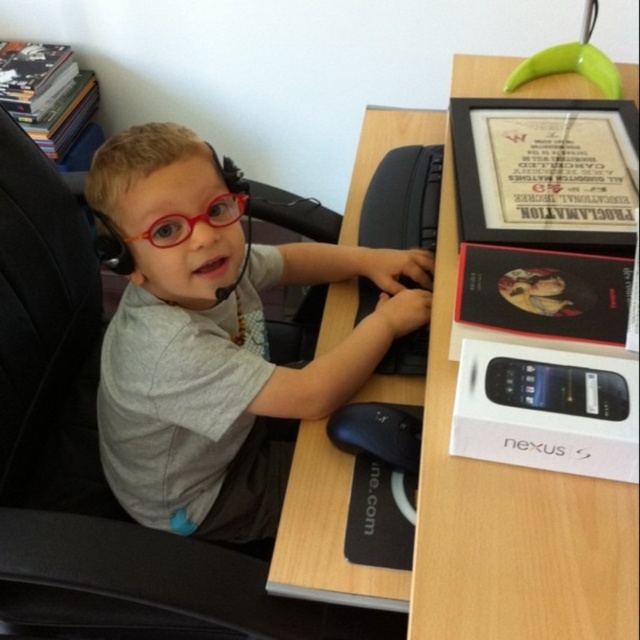
Is wooden at center to the right of black textured keyboard at center from the viewer's perspective?

Indeed, wooden at center is positioned on the right side of black textured keyboard at center.

Looking at this image, does wooden at center appear on the left side of black textured keyboard at center?

In fact, wooden at center is to the right of black textured keyboard at center.

Where is `wooden at center`? wooden at center is located at coordinates (460, 492).

Locate an element on the screen. wooden at center is located at coordinates (460, 492).

Does wooden at center lie in front of red plastic glasses at center?

Yes, it is.

Locate an element on the screen. wooden at center is located at coordinates (460, 492).

You are a GUI agent. You are given a task and a screenshot of the screen. Output one action in this format:
    pyautogui.click(x=<x>, y=<y>)
    Task: Click on the matte gray shirt at center
    This screenshot has height=640, width=640.
    Given the screenshot: What is the action you would take?
    pyautogui.click(x=216, y=340)

Which is above, matte gray shirt at center or red plastic glasses at center?

Positioned higher is red plastic glasses at center.

Locate an element on the screen. matte gray shirt at center is located at coordinates (216, 340).